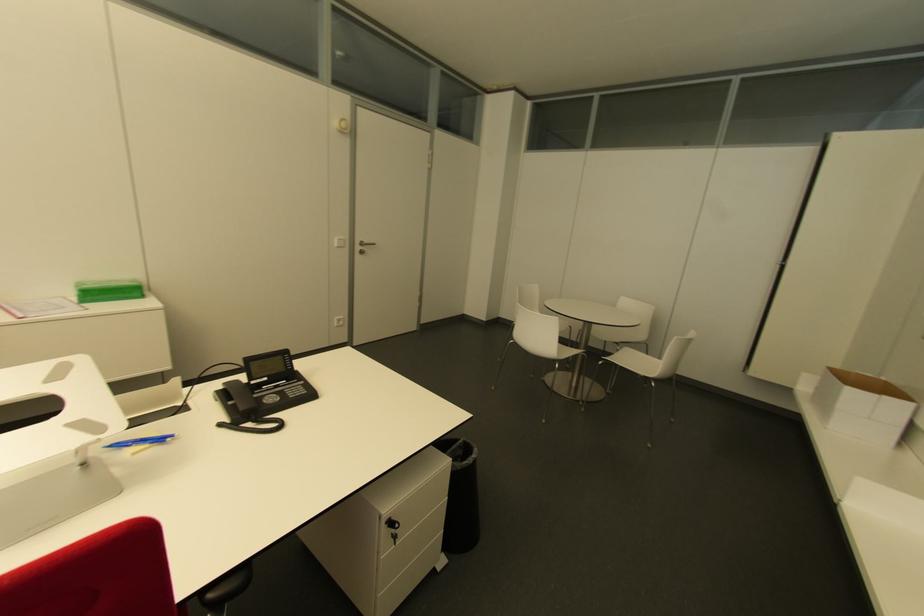
The width and height of the screenshot is (924, 616). Identify the location of silver door handle. (x=363, y=245).